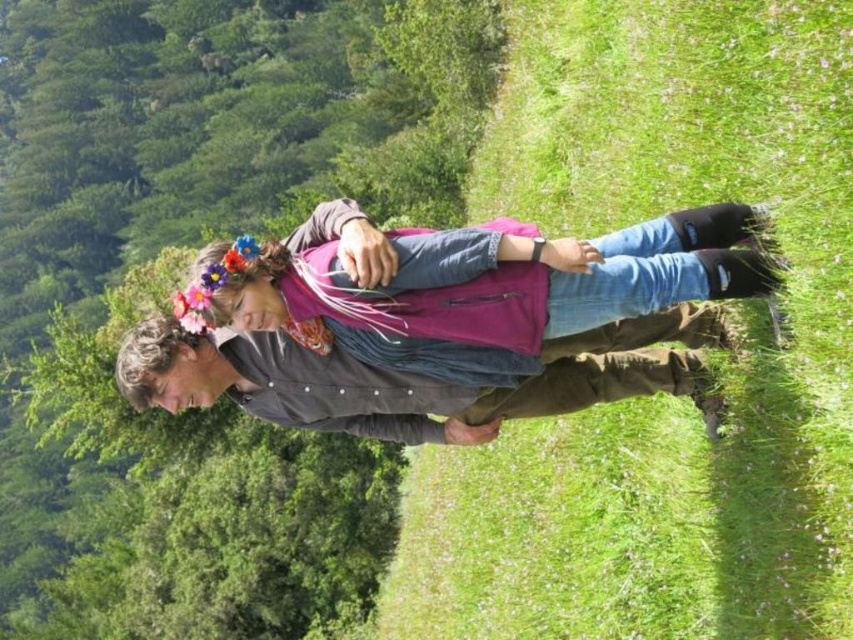
Question: Which of the following is the farthest from the observer?

Choices:
 (A) denim jacket at center
 (B) green grassy field at center

Answer: (A)

Question: Can you confirm if green grassy field at center is wider than denim jacket at center?

Choices:
 (A) yes
 (B) no

Answer: (B)

Question: In this image, where is green grassy field at center located relative to denim jacket at center?

Choices:
 (A) left
 (B) right

Answer: (B)

Question: Can you confirm if green grassy field at center is wider than denim jacket at center?

Choices:
 (A) yes
 (B) no

Answer: (B)

Question: Which point is farther to the camera?

Choices:
 (A) (816, 596)
 (B) (401, 269)

Answer: (B)